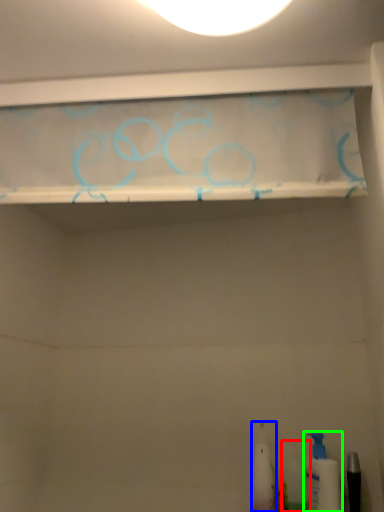
Question: Based on their relative distances, which object is nearer to toiletry (highlighted by a red box)? Choose from toiletry (highlighted by a blue box) and toiletry (highlighted by a green box).

Choices:
 (A) toiletry
 (B) toiletry

Answer: (B)